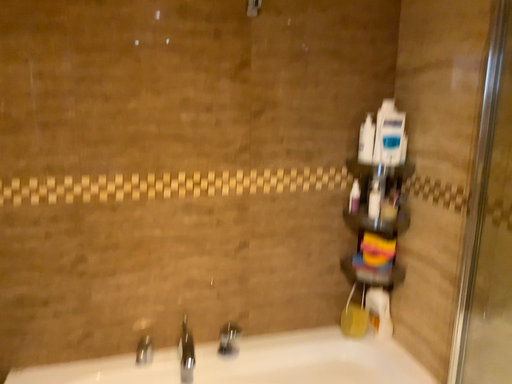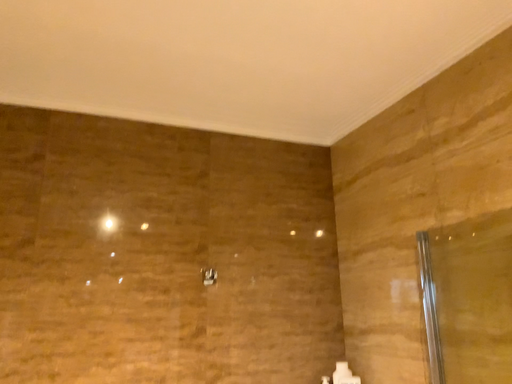
Question: How did the camera likely rotate when shooting the video?

Choices:
 (A) rotated right
 (B) rotated left

Answer: (A)